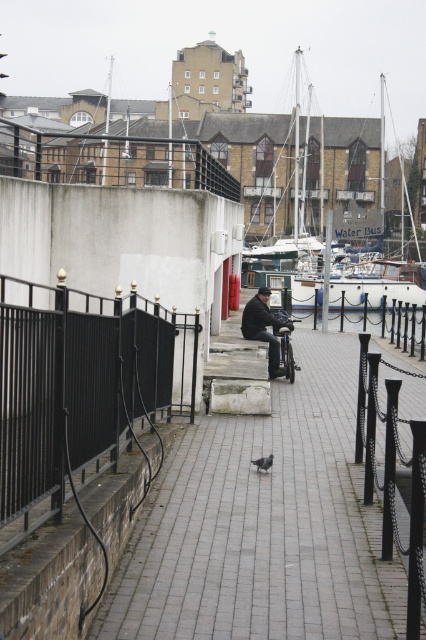
You are a photographer standing on the waterfront walkway. You want to take a photo of the white wooden boat at center and the gray matte pigeon at center. Based on their positions, which object should you focus on first to ensure both are in sharp focus?

The gray matte pigeon at center is behind the white wooden boat at center, so you should focus on the white wooden boat at center first to ensure both are in sharp focus.

You are standing on the walkway and want to throw a small pebble to hit both the white wooden boat at center and the gray matte pigeon at center. Which one should you aim for first if you want to hit them in order from closest to farthest?

The gray matte pigeon at center is closer to you than the white wooden boat at center, so you should aim for the gray matte pigeon at center first.

You are a birdwatcher observing the waterfront scene. You notice the black metal fence at left and the gray matte pigeon at center. Which object is taller?

The black metal fence at left is taller than the gray matte pigeon at center according to the description.